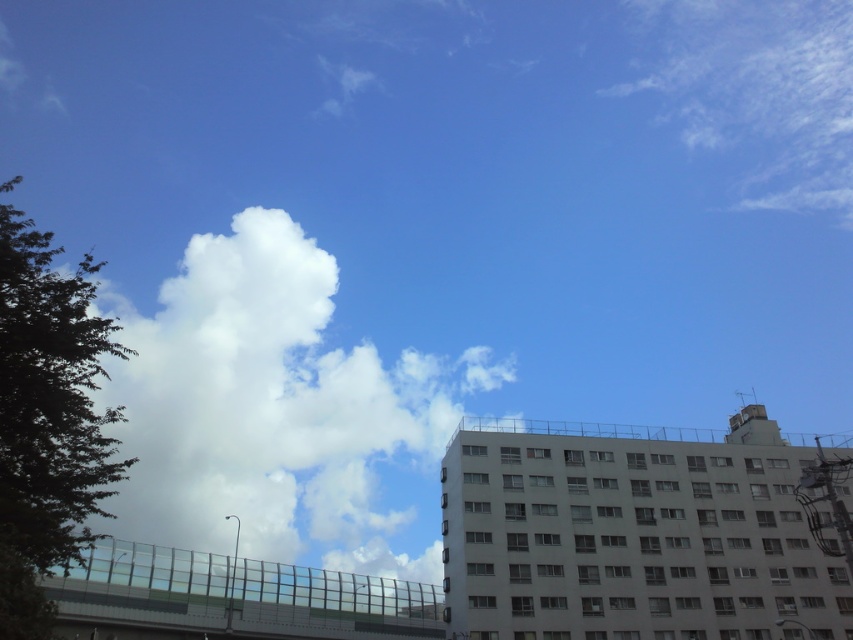
You are an architect designing a new skyscraper and want to ensure that the white fluffy cloud at upper left in the image won not block the view from the top floor. Based on its 2D coordinates, can you determine if the cloud will be visible from the top floor?

The white fluffy cloud at upper left is located at coordinates (276, 408) in the image, which means it is positioned in the upper left quadrant. Since the top floor of the skyscraper would have a view facing downward and outward, the cloud might still be visible depending on the building height and angle, but the exact visibility cannot be determined solely from 2D coordinates.